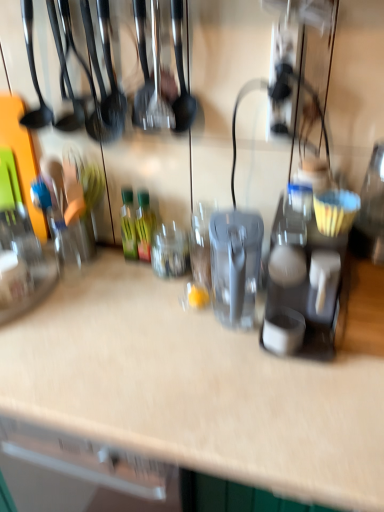
You are a GUI agent. You are given a task and a screenshot of the screen. Output one action in this format:
    pyautogui.click(x=<x>, y=<y>)
    Task: Click on the vacant area that lies in front of green glass bottle at center, positioned as the first bottle in left-to-right order
    This screenshot has height=512, width=384.
    Given the screenshot: What is the action you would take?
    pyautogui.click(x=120, y=287)